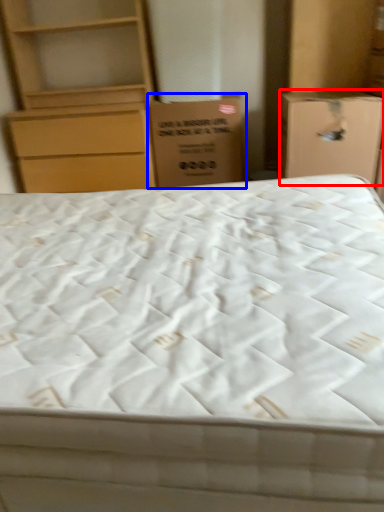
Question: Which object appears closest to the camera in this image, cardboard box (highlighted by a red box) or cardboard box (highlighted by a blue box)?

Choices:
 (A) cardboard box
 (B) cardboard box

Answer: (A)